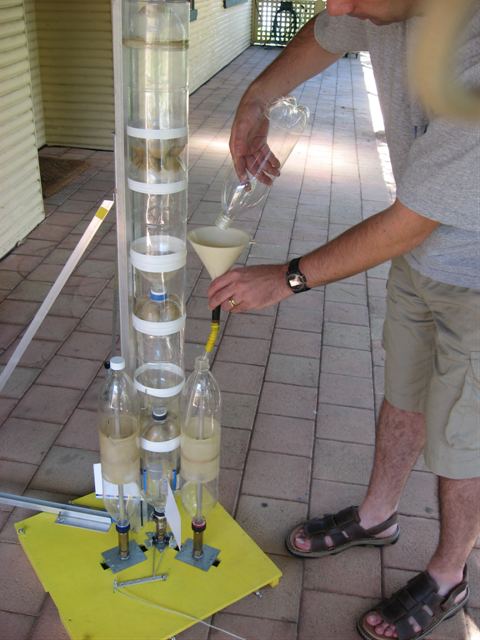
This screenshot has height=640, width=480. I want to click on tile floor, so click(x=284, y=410).